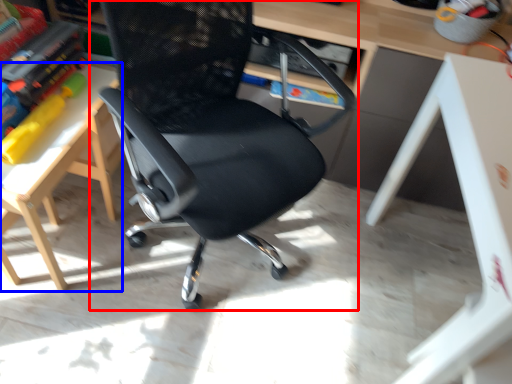
Question: Among these objects, which one is farthest to the camera, chair (highlighted by a red box) or table (highlighted by a blue box)?

Choices:
 (A) chair
 (B) table

Answer: (B)